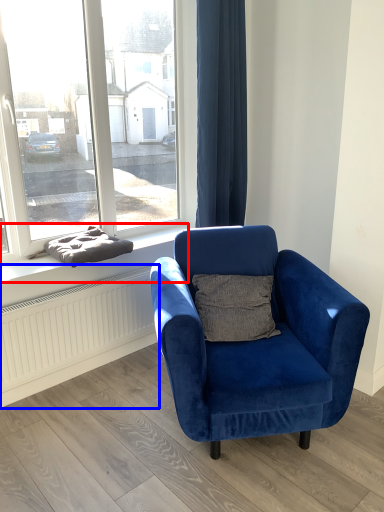
Question: Which object appears farthest to the camera in this image, window sill (highlighted by a red box) or radiator (highlighted by a blue box)?

Choices:
 (A) window sill
 (B) radiator

Answer: (B)